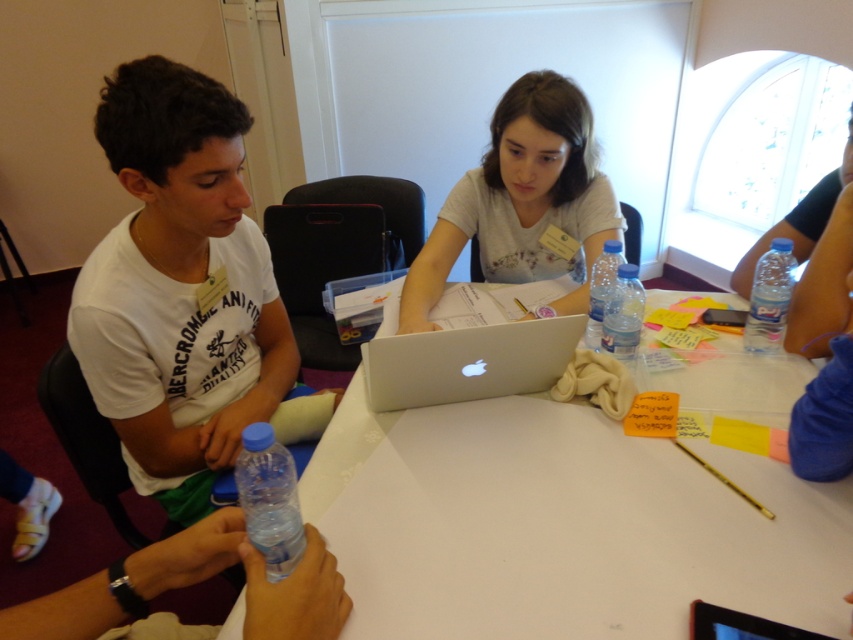
At what (x,y) coordinates should I click in order to perform the action: click on white plastic table at center. Please return your answer as a coordinate pair (x, y). The height and width of the screenshot is (640, 853). Looking at the image, I should click on (561, 525).

Is white plastic table at center bigger than clear plastic bottle at center?

Yes, white plastic table at center is bigger than clear plastic bottle at center.

The height and width of the screenshot is (640, 853). Identify the location of white plastic table at center. (561, 525).

Identify the location of white plastic table at center. This screenshot has height=640, width=853. (561, 525).

Between silver metallic laptop at center and clear plastic bottle at center, which one has more height?

With more height is clear plastic bottle at center.

Does point (381, 374) lie in front of point (601, 275)?

Yes.

The height and width of the screenshot is (640, 853). In order to click on silver metallic laptop at center in this screenshot , I will do `click(465, 360)`.

Looking at this image, is white plastic table at center below blue plastic bottle at lower left?

Indeed, white plastic table at center is positioned under blue plastic bottle at lower left.

Is white plastic table at center taller than blue plastic bottle at lower left?

Yes.

Which is in front, point (733, 508) or point (250, 525)?

Positioned in front is point (250, 525).

The height and width of the screenshot is (640, 853). I want to click on white plastic table at center, so click(561, 525).